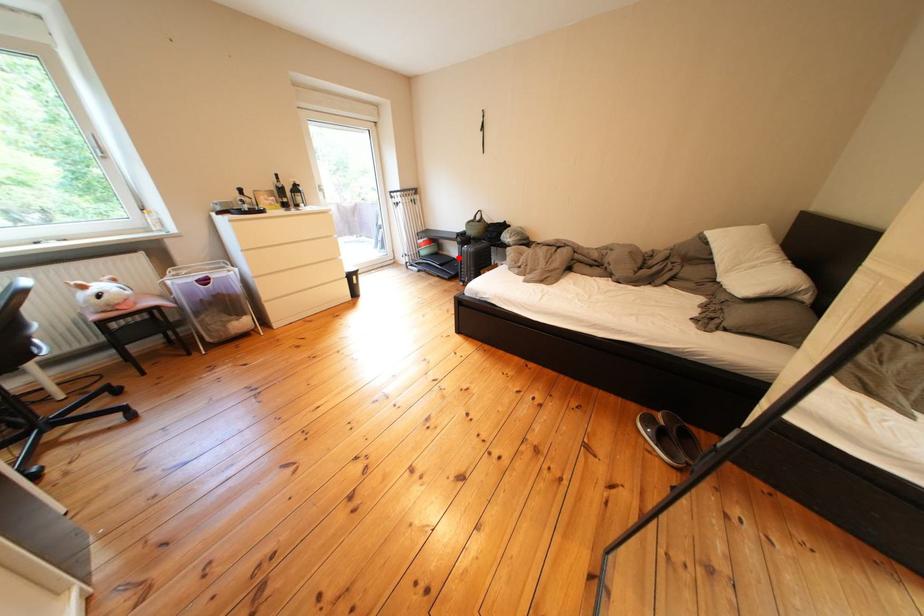
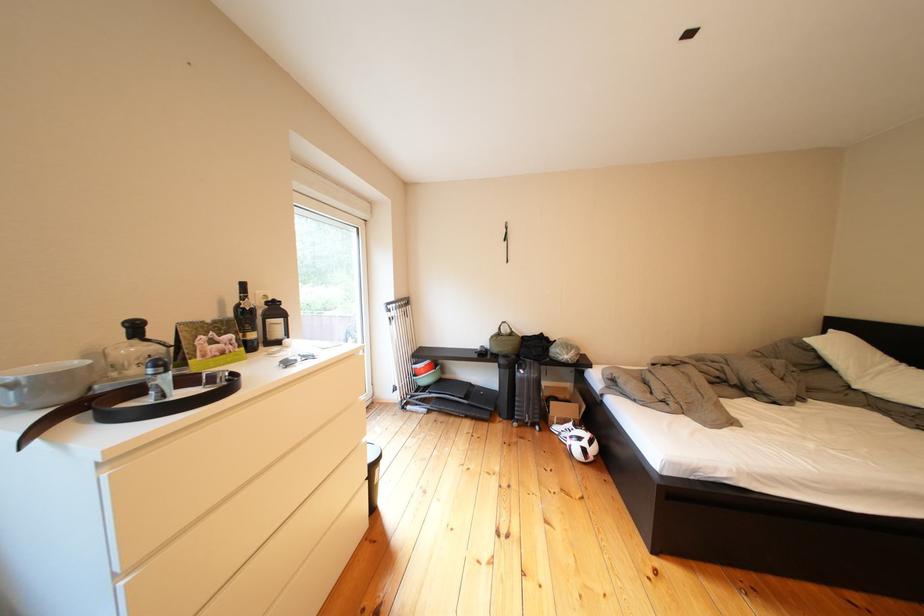
Question: A red point is marked in image1. In image2, is the corresponding 3D point closer to the camera or farther? Reply with the corresponding letter.

Choices:
 (A) The corresponding 3D point is closer.
 (B) The corresponding 3D point is farther.

Answer: (B)